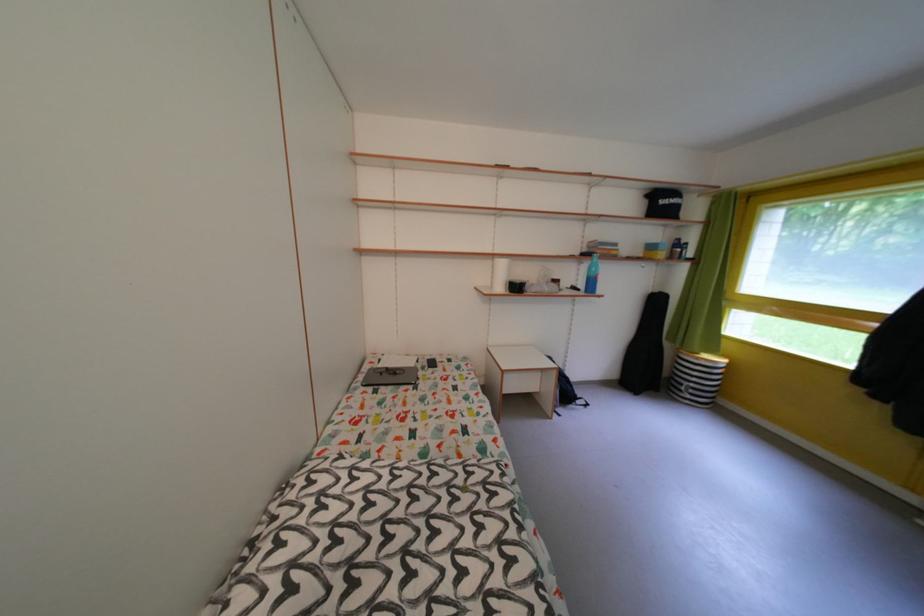
Image resolution: width=924 pixels, height=616 pixels. Describe the element at coordinates (646, 347) in the screenshot. I see `the black guitar case` at that location.